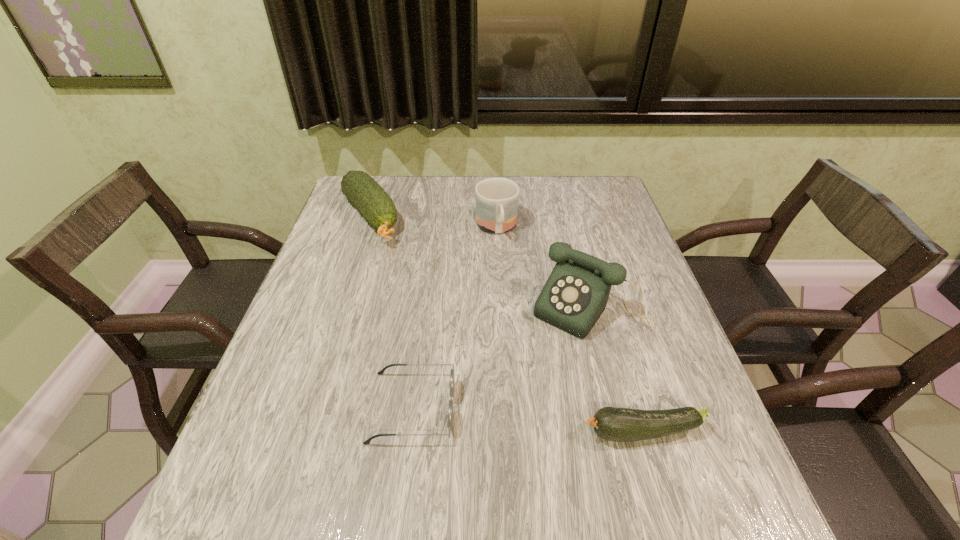
This screenshot has height=540, width=960. I want to click on free spot between the fourth object from right to left and the zucchini, so (527, 420).

Where is `free spot between the telephone and the third object from left to right`? The height and width of the screenshot is (540, 960). free spot between the telephone and the third object from left to right is located at coordinates (544, 268).

The height and width of the screenshot is (540, 960). Find the location of `empty space that is in between the third nearest object and the zucchini`. empty space that is in between the third nearest object and the zucchini is located at coordinates (617, 370).

At what (x,y) coordinates should I click in order to perform the action: click on vacant point located between the zucchini and the telephone. Please return your answer as a coordinate pair (x, y). Looking at the image, I should click on (617, 370).

Identify which object is the nearest to the zucchini. Please provide its 2D coordinates. Your answer should be formatted as a tuple, i.e. [(x, y)], where the tuple contains the x and y coordinates of a point satisfying the conditions above.

[(575, 295)]

Find the location of a particular element. Image resolution: width=960 pixels, height=540 pixels. the fourth closest object relative to the fourth object from right to left is located at coordinates (496, 199).

What are the coordinates of `free spot that satisfies the following two spatial constraints: 1. on the front side of the third nearest object; 2. at the blossom end of the zucchini` in the screenshot? It's located at (623, 432).